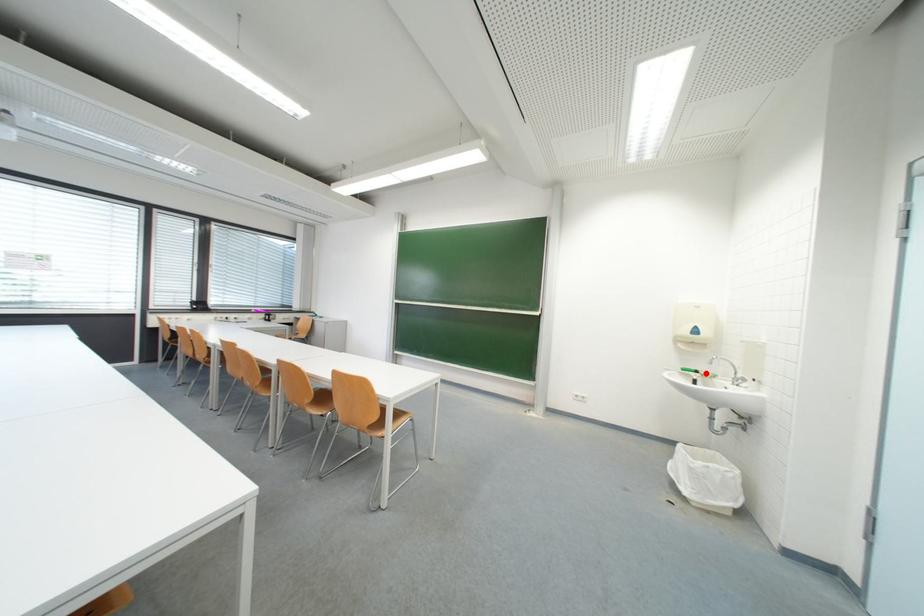
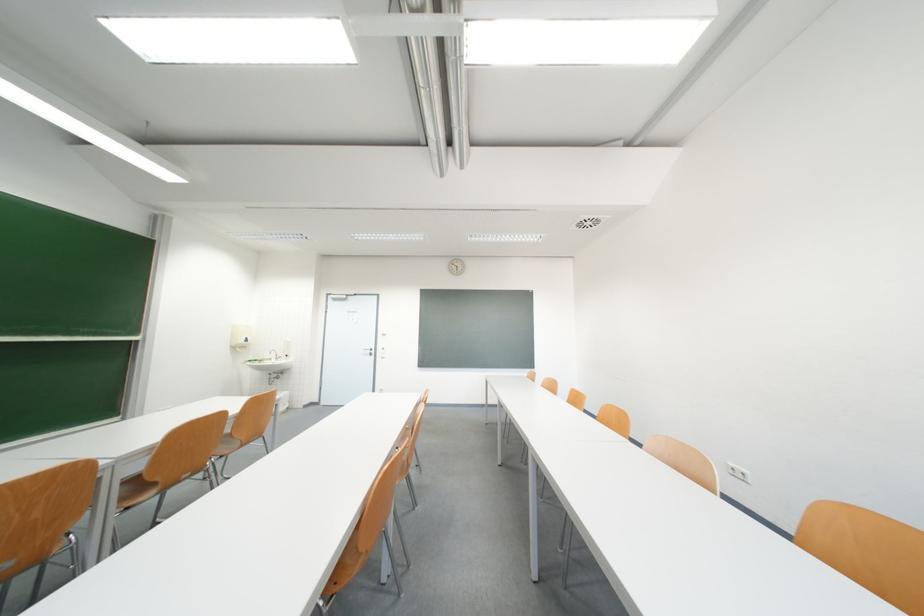
Question: I am providing you with two images of the same scene from different viewpoints. A red point is marked on the first image. Can you still see the location of the red point in image 2?

Choices:
 (A) Yes
 (B) No

Answer: (B)